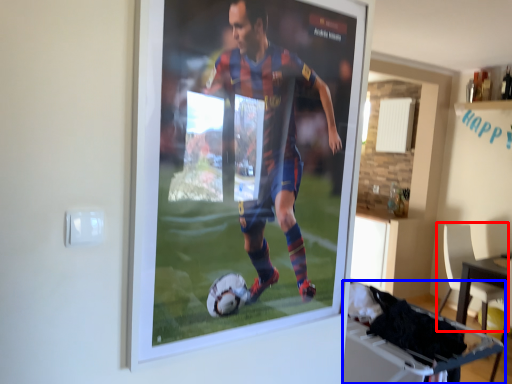
Question: Which point is further to the camera, chair (highlighted by a red box) or table (highlighted by a blue box)?

Choices:
 (A) chair
 (B) table

Answer: (A)